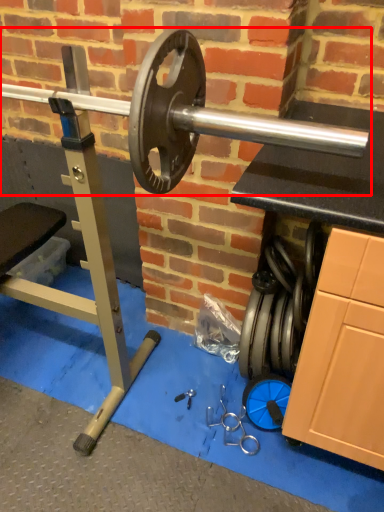
Question: Observing the image, what is the correct spatial positioning of barbell (annotated by the red box) in reference to tool?

Choices:
 (A) left
 (B) right

Answer: (A)